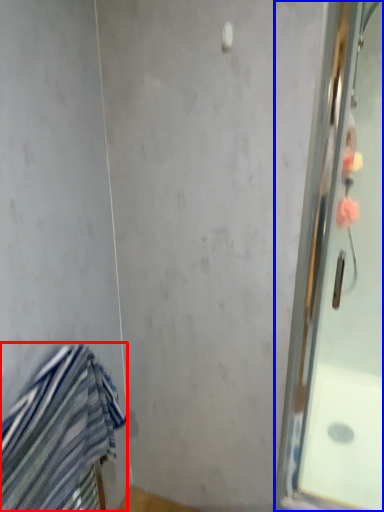
Question: Which object appears farthest to the camera in this image, towel (highlighted by a red box) or screen door (highlighted by a blue box)?

Choices:
 (A) towel
 (B) screen door

Answer: (B)